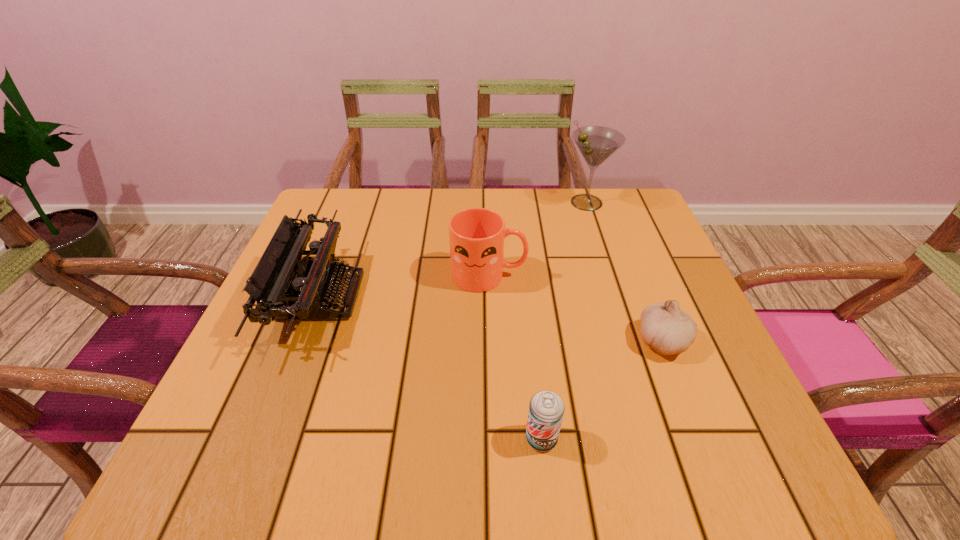
You are a GUI agent. You are given a task and a screenshot of the screen. Output one action in this format:
    pyautogui.click(x=<x>, y=<y>)
    Task: Click on the vacant space located on the right of the beer can
    The width and height of the screenshot is (960, 540).
    Given the screenshot: What is the action you would take?
    pyautogui.click(x=656, y=438)

This screenshot has width=960, height=540. What are the coordinates of `object that is at the far edge` in the screenshot? It's located at (596, 144).

In order to click on object that is at the near edge in this screenshot , I will do `click(546, 409)`.

Find the location of a particular element. The image size is (960, 540). object present at the left edge is located at coordinates (312, 280).

I want to click on martini that is at the right edge, so click(x=596, y=144).

Where is `garlic located in the right edge section of the desktop`? garlic located in the right edge section of the desktop is located at coordinates (667, 329).

Locate an element on the screen. object located at the far right corner is located at coordinates (596, 144).

In the image, there is a desktop. Identify the location of vacant space at the far edge. (539, 206).

At what (x,y) coordinates should I click in order to perform the action: click on vacant space at the near edge of the desktop. Please return your answer as a coordinate pair (x, y). The image size is (960, 540). Looking at the image, I should click on (516, 457).

Where is `vacant space at the left edge`? Image resolution: width=960 pixels, height=540 pixels. vacant space at the left edge is located at coordinates (308, 320).